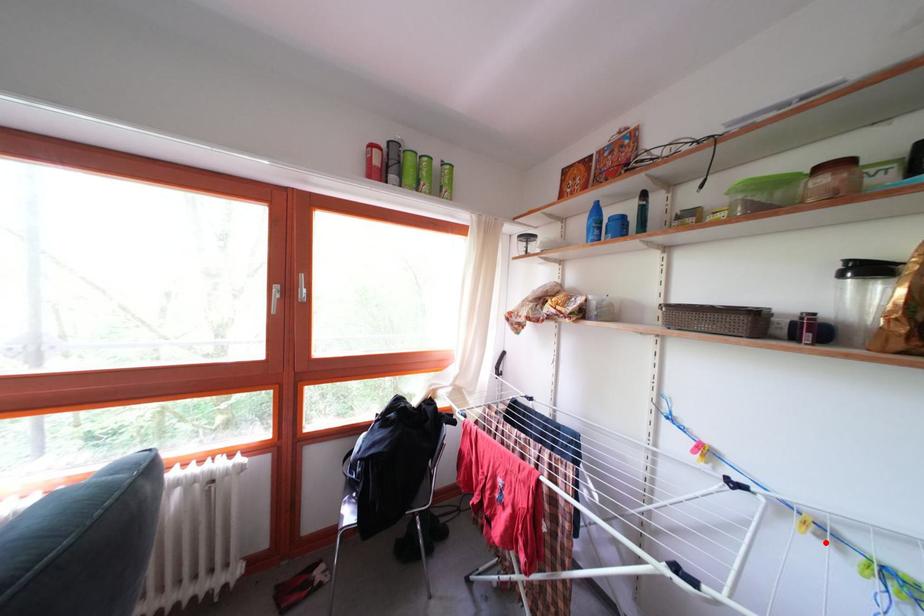
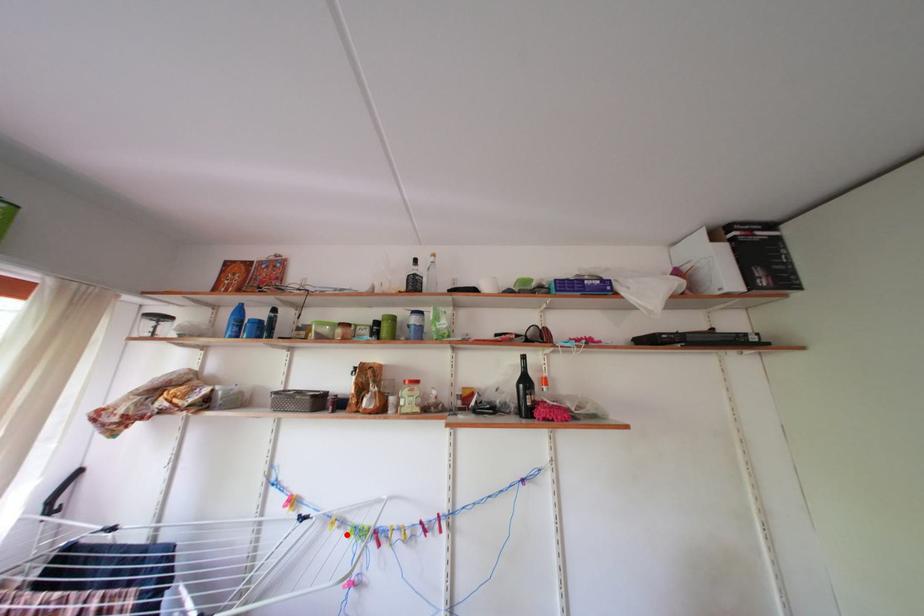
I am providing you with two images of the same scene from different viewpoints. A red point is marked on the first image and another point is marked on the second image. Are the points marked in image1 and image2 representing the same 3D position?

Yes